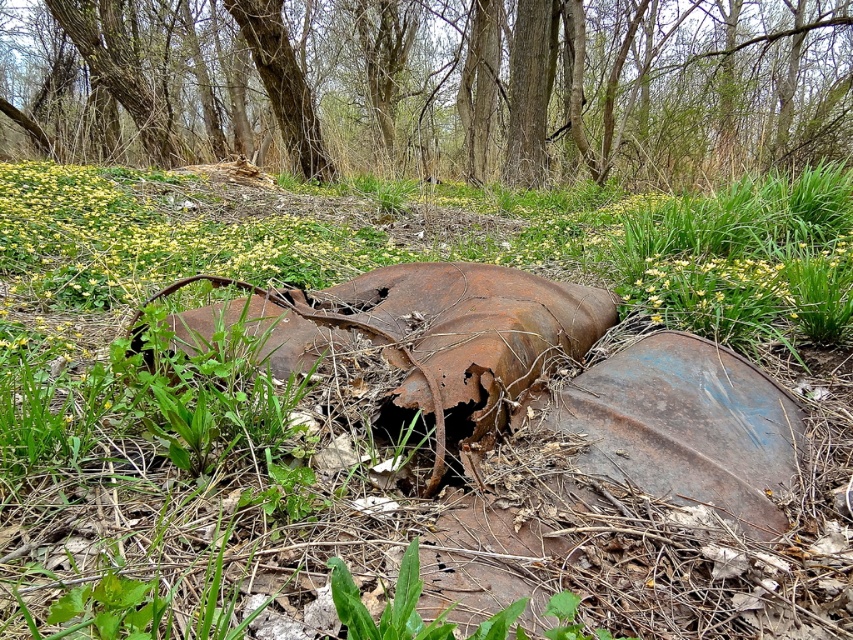
Measure the distance between green grass at center and smooth bark tree at upper center.

30.94 feet

This screenshot has height=640, width=853. Find the location of `green grass at center`. green grass at center is located at coordinates (392, 445).